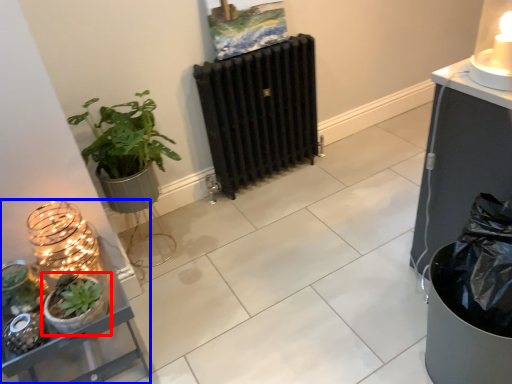
Question: Which of the following is the closest to the observer, houseplant (highlighted by a red box) or shelf (highlighted by a blue box)?

Choices:
 (A) houseplant
 (B) shelf

Answer: (B)